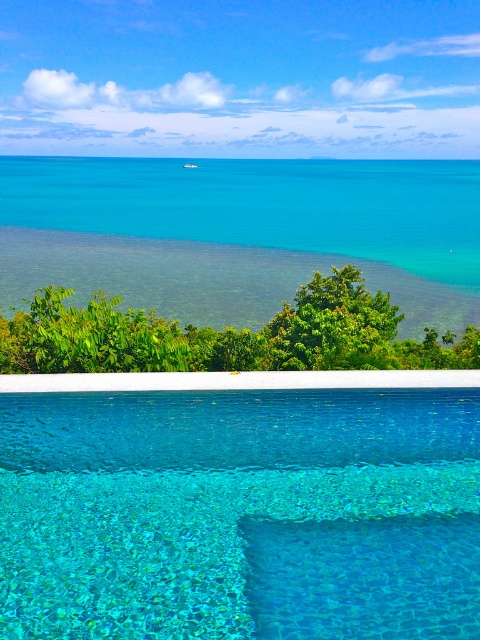
You are a swimmer wanting to jump into the water. You see the transparent glass pool at center and the clear blue water at center. Which one should you jump into to enter the water?

You should jump into the clear blue water at center because the transparent glass pool at center is located below it, meaning the water is above the glass structure.

You are planning to host a pool party and need to know the dimensions of the transparent glass pool at center and the clear blue water at center. Which one is narrower in width?

The transparent glass pool at center is narrower in width than the clear blue water at center.